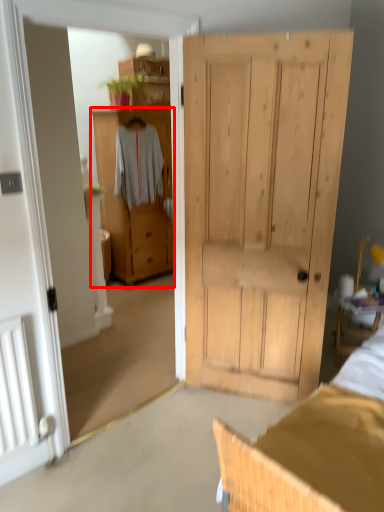
Question: From the image, what is the correct spatial relationship of cabinetry (annotated by the red box) in relation to clothing?

Choices:
 (A) left
 (B) right

Answer: (B)